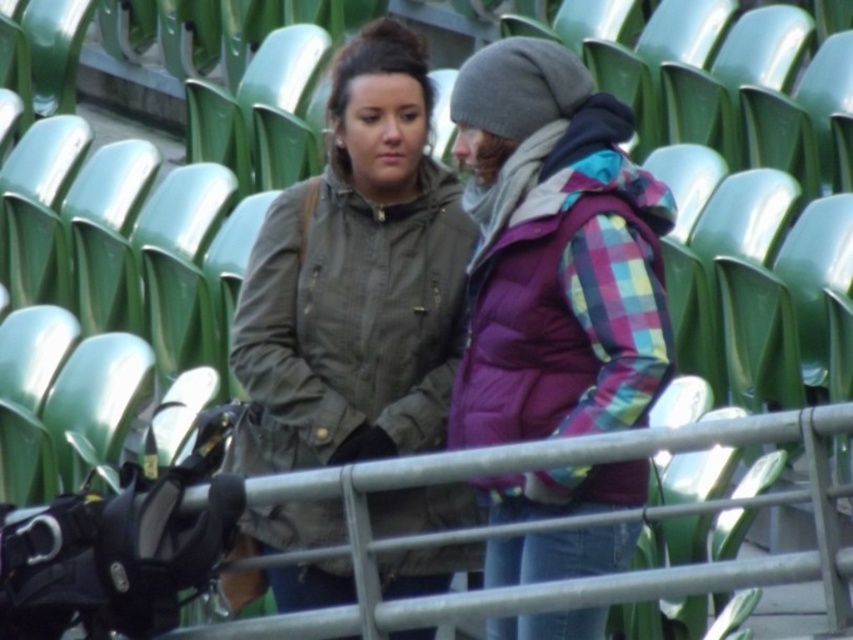
Question: Does matte olive green jacket at center have a smaller size compared to plaid puffer jacket at center?

Choices:
 (A) yes
 (B) no

Answer: (A)

Question: Which point appears farthest from the camera in this image?

Choices:
 (A) (316, 413)
 (B) (570, 410)

Answer: (A)

Question: Can you confirm if matte olive green jacket at center is bigger than plaid puffer jacket at center?

Choices:
 (A) no
 (B) yes

Answer: (A)

Question: Which object appears farthest from the camera in this image?

Choices:
 (A) plaid puffer jacket at center
 (B) matte olive green jacket at center

Answer: (B)

Question: Does matte olive green jacket at center appear on the left side of plaid puffer jacket at center?

Choices:
 (A) no
 (B) yes

Answer: (B)